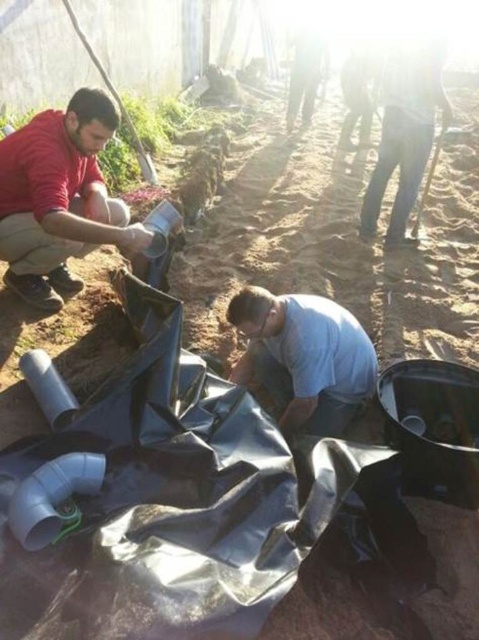
Consider the image. Is light blue fabric at center below dark blue jeans at right?

Yes, light blue fabric at center is below dark blue jeans at right.

Measure the distance between light blue fabric at center and dark blue jeans at right.

light blue fabric at center and dark blue jeans at right are 7.93 feet apart.

Which is in front, point (277, 330) or point (379, 166)?

Positioned in front is point (277, 330).

At what (x,y) coordinates should I click in order to perform the action: click on light blue fabric at center. Please return your answer as a coordinate pair (x, y). This screenshot has width=479, height=640. Looking at the image, I should click on (304, 356).

Consider the image. Is matte red shirt at upper left smaller than light blue fabric at center?

Actually, matte red shirt at upper left might be larger than light blue fabric at center.

Which is behind, point (76, 140) or point (308, 410)?

The point (76, 140) is behind.

Find the location of a particular element. matte red shirt at upper left is located at coordinates (59, 198).

Between matte red shirt at upper left and dark blue jeans at right, which one appears on the left side from the viewer's perspective?

matte red shirt at upper left is more to the left.

Is point (25, 252) farther from camera compared to point (444, 112)?

No.

This screenshot has height=640, width=479. What do you see at coordinates (59, 198) in the screenshot?
I see `matte red shirt at upper left` at bounding box center [59, 198].

You are a GUI agent. You are given a task and a screenshot of the screen. Output one action in this format:
    pyautogui.click(x=<x>, y=<y>)
    Task: Click on the matte red shirt at upper left
    
    Given the screenshot: What is the action you would take?
    pyautogui.click(x=59, y=198)